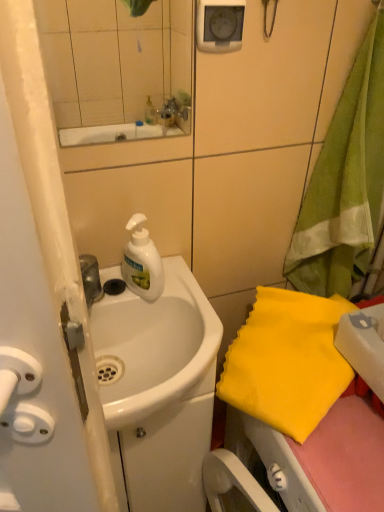
Question: In the image, is white glossy sink at center positioned in front of or behind yellow fabric at right, which is counted as the first beach towel, starting from the top?

Choices:
 (A) front
 (B) behind

Answer: (B)

Question: Is white glossy sink at center situated inside yellow fabric at right, which is counted as the first beach towel, starting from the top, or outside?

Choices:
 (A) outside
 (B) inside

Answer: (A)

Question: Which of these objects is positioned farthest from the matte glass mirror at upper center?

Choices:
 (A) yellow fabric at lower right, the 2th beach towel in the top-to-bottom sequence
 (B) yellow fabric at right, which is counted as the first beach towel, starting from the top
 (C) white glossy sink at center
 (D) white matte liquid soap at center

Answer: (A)

Question: Estimate the real-world distances between objects in this image. Which object is farther from the white matte liquid soap at center?

Choices:
 (A) white glossy sink at center
 (B) yellow fabric at right, arranged as the 2th beach towel when ordered from the bottom
 (C) yellow fabric at lower right, the 2th beach towel in the top-to-bottom sequence
 (D) matte glass mirror at upper center

Answer: (B)